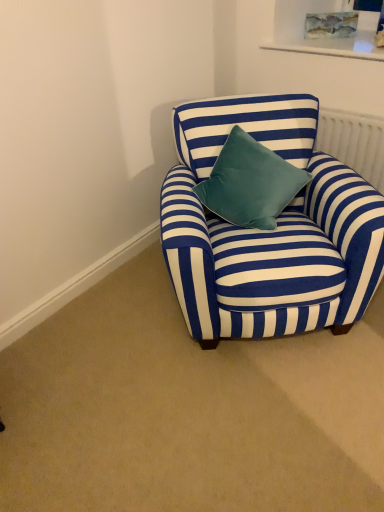
Question: In the image, is blue striped fabric armchair at center positioned in front of or behind velvet teal pillow at center?

Choices:
 (A) behind
 (B) front

Answer: (B)

Question: Is point (377, 221) positioned closer to the camera than point (243, 153)?

Choices:
 (A) closer
 (B) farther

Answer: (A)

Question: Considering the real-world distances, which object is farthest from the blue striped fabric armchair at center?

Choices:
 (A) white textured radiator at upper right
 (B) velvet teal pillow at center

Answer: (A)

Question: Based on their relative distances, which object is nearer to the white textured radiator at upper right?

Choices:
 (A) blue striped fabric armchair at center
 (B) velvet teal pillow at center

Answer: (A)